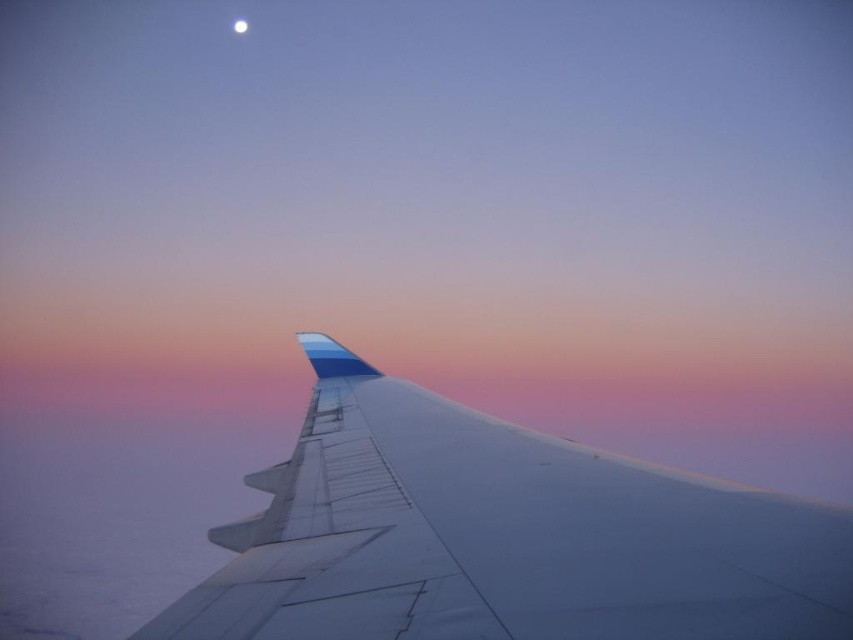
Question: Which point is closer to the camera?

Choices:
 (A) white matte airplane wing at center
 (B) white glossy moon at upper center

Answer: (A)

Question: Observing the image, what is the correct spatial positioning of white matte airplane wing at center in reference to white glossy moon at upper center?

Choices:
 (A) above
 (B) below

Answer: (B)

Question: Which point appears farthest from the camera in this image?

Choices:
 (A) (239, 32)
 (B) (502, 538)

Answer: (A)

Question: Does white matte airplane wing at center come in front of white glossy moon at upper center?

Choices:
 (A) yes
 (B) no

Answer: (A)

Question: From the image, what is the correct spatial relationship of white matte airplane wing at center in relation to white glossy moon at upper center?

Choices:
 (A) right
 (B) left

Answer: (A)